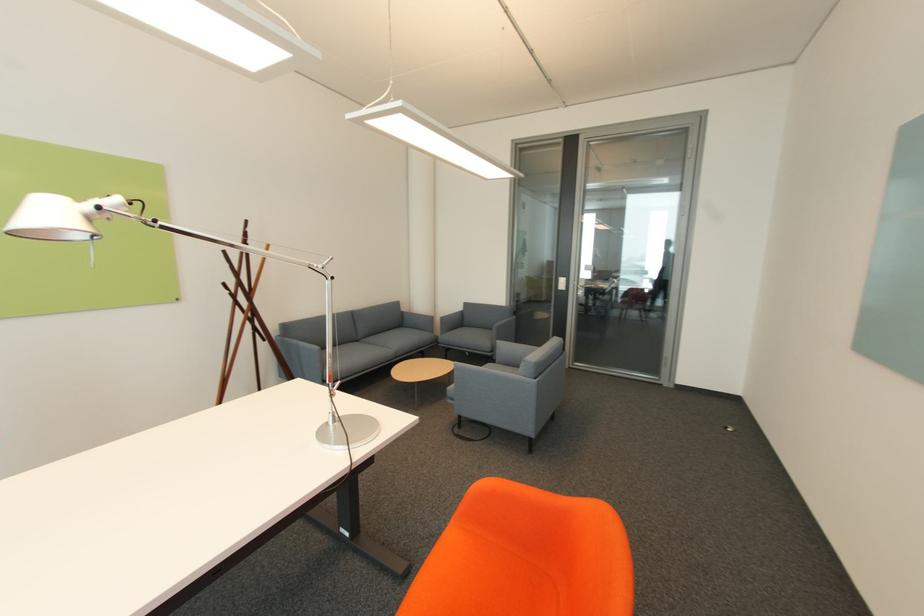
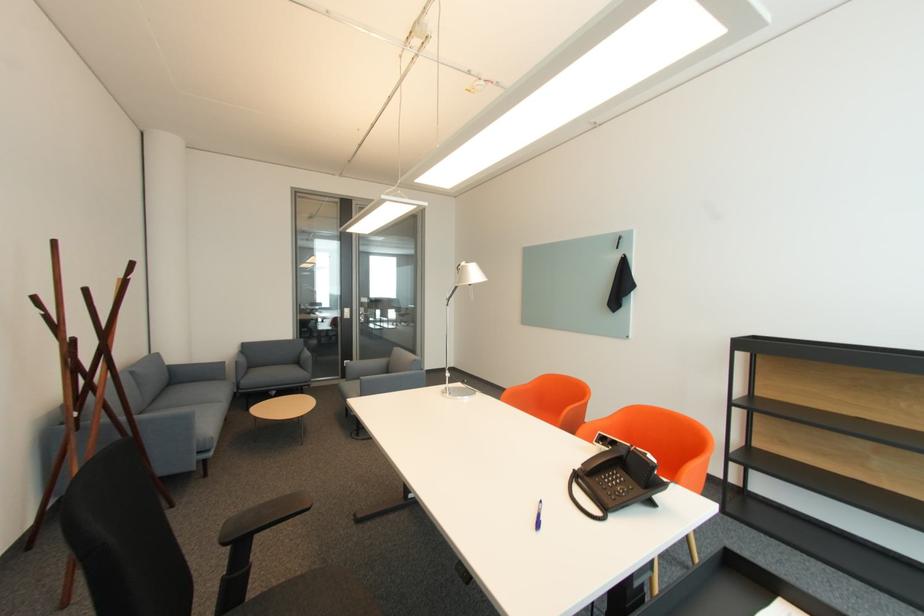
Locate, in the second image, the point that corresponds to pixel 365 341 in the first image.

(151, 411)